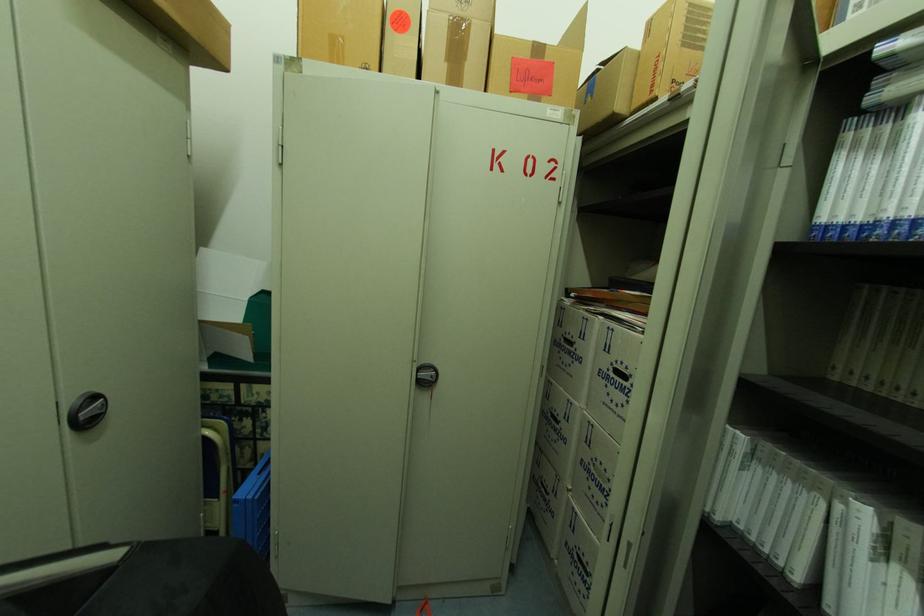
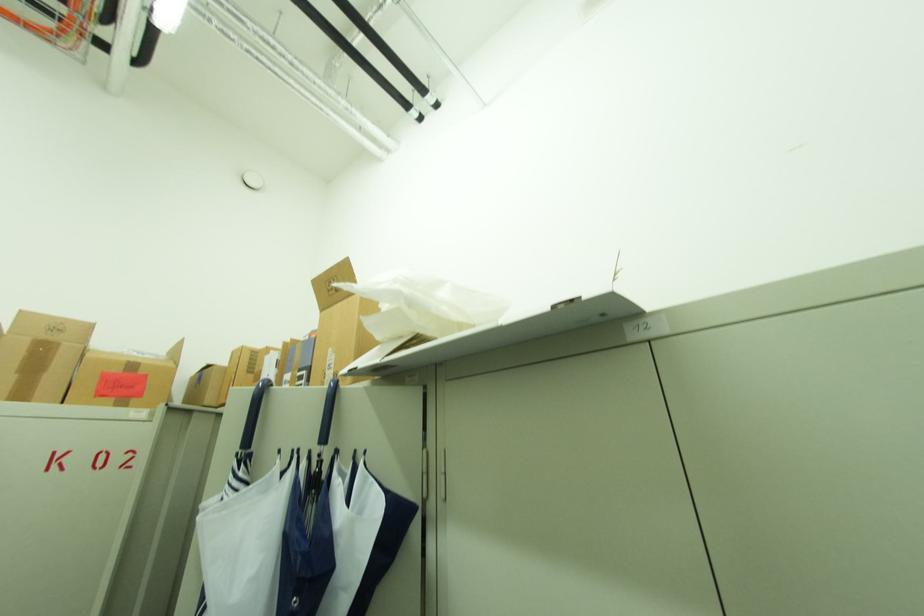
Based on the continuous images, in which direction is the camera rotating?

The camera rotated toward right-up.